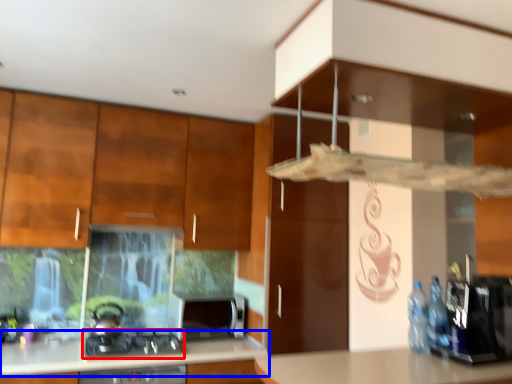
Question: Among these objects, which one is nearest to the camera, gas stove (highlighted by a red box) or countertop (highlighted by a blue box)?

Choices:
 (A) gas stove
 (B) countertop

Answer: (B)